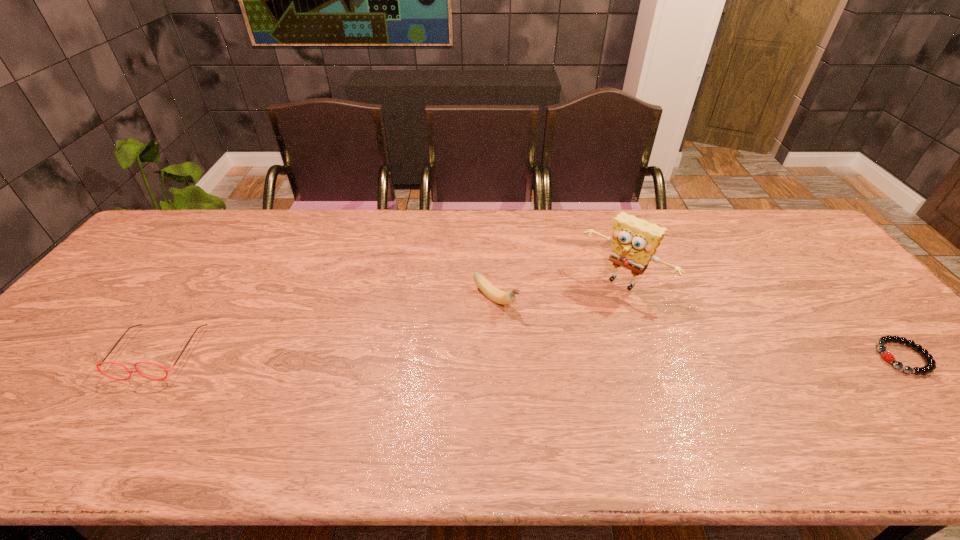
The width and height of the screenshot is (960, 540). In order to click on vacant spot on the desktop that is between the spectacles and the rightmost object and is positioned on the face of the tallest object in this screenshot , I will do `click(560, 355)`.

The image size is (960, 540). In order to click on vacant space on the desktop that is between the third tallest object and the bracelet and is positioned at the stem of the third object from right to left in this screenshot , I will do `click(569, 355)`.